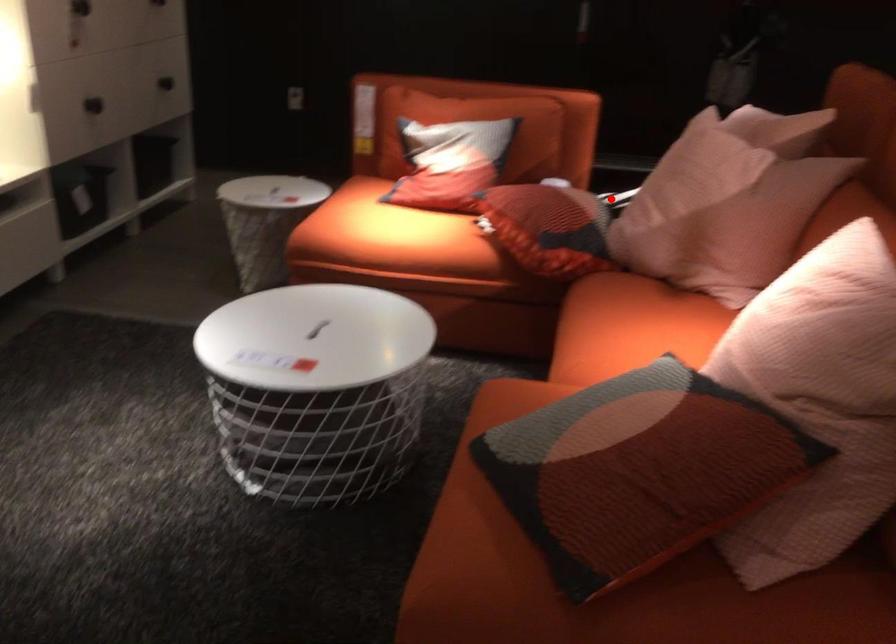
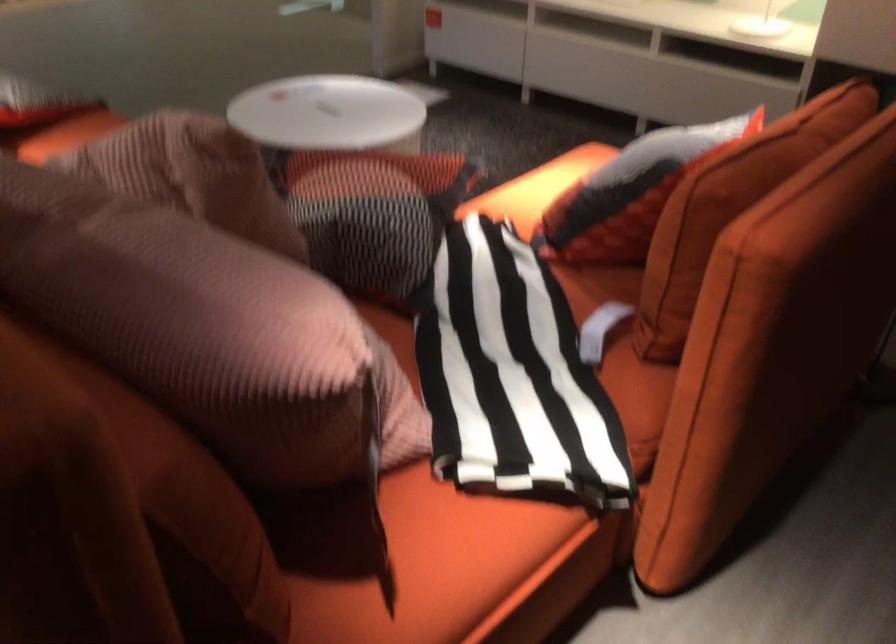
Question: I am providing you with two images of the same scene from different viewpoints. In image1, a red point is highlighted. Considering the same 3D point in image2, which of the following is correct?

Choices:
 (A) It is closer
 (B) It is farther

Answer: (A)